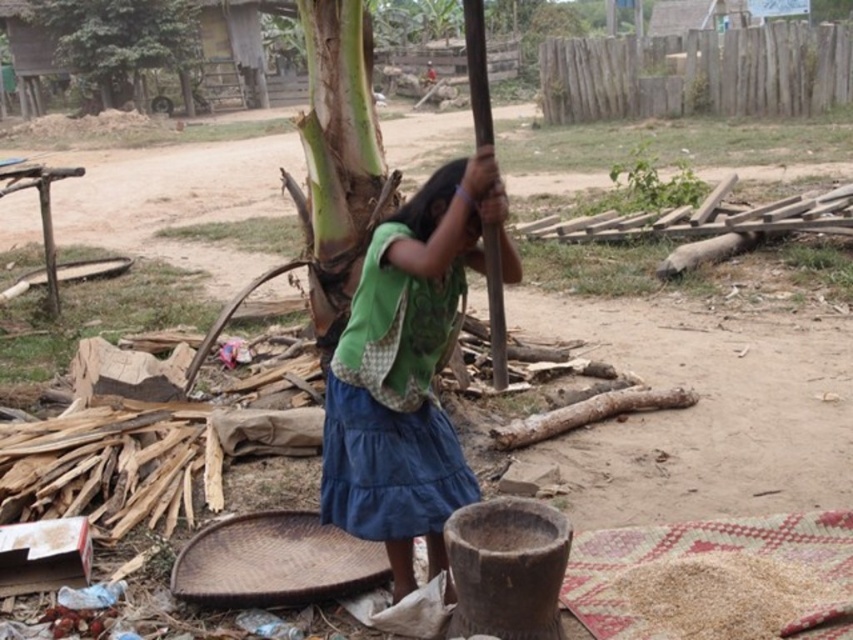
Question: Can you confirm if green fabric bag at center is positioned to the right of green leafy tree at upper left?

Choices:
 (A) yes
 (B) no

Answer: (A)

Question: Which of the following is the closest to the observer?

Choices:
 (A) green leafy tree at upper left
 (B) green fabric bag at center
 (C) brown wooden pole at center

Answer: (B)

Question: Which of these objects is positioned farthest from the green fabric bag at center?

Choices:
 (A) green leafy tree at upper left
 (B) brown wooden pole at center

Answer: (A)

Question: Does green leafy tree at upper left have a smaller size compared to brown wooden pole at center?

Choices:
 (A) no
 (B) yes

Answer: (A)

Question: Where is brown wooden pole at center located in relation to dark green fabric at center in the image?

Choices:
 (A) right
 (B) left

Answer: (A)

Question: Which of the following is the closest to the observer?

Choices:
 (A) green fabric bag at center
 (B) dark green fabric at center
 (C) green leafy tree at upper left
 (D) brown wooden pole at center

Answer: (A)